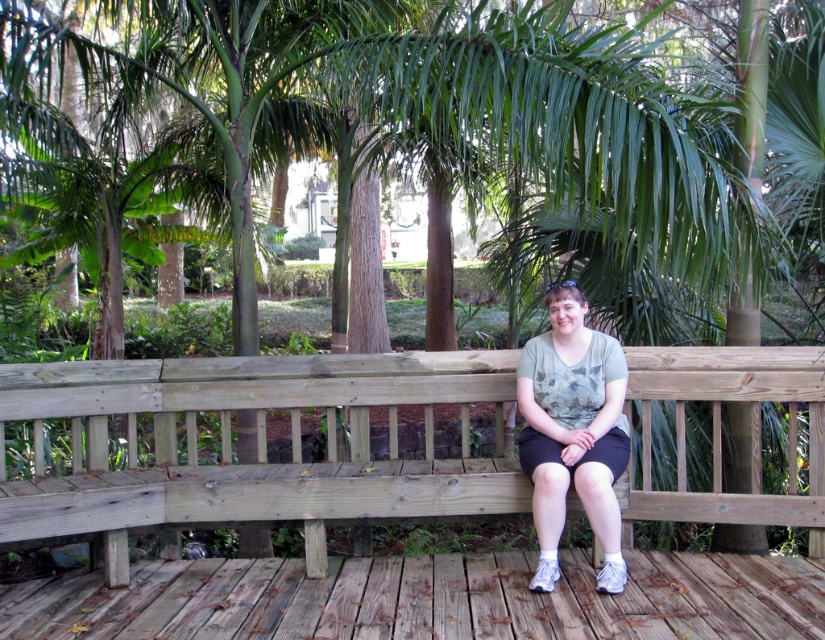
Question: Can you confirm if wooden bench at center is positioned below camouflage t-shirt at center?

Choices:
 (A) yes
 (B) no

Answer: (A)

Question: Can you confirm if wooden bench at center is positioned above camouflage t-shirt at center?

Choices:
 (A) no
 (B) yes

Answer: (A)

Question: Does wooden bench at center appear on the right side of camouflage t-shirt at center?

Choices:
 (A) no
 (B) yes

Answer: (A)

Question: Which point appears farthest from the camera in this image?

Choices:
 (A) (347, 374)
 (B) (555, 524)

Answer: (A)